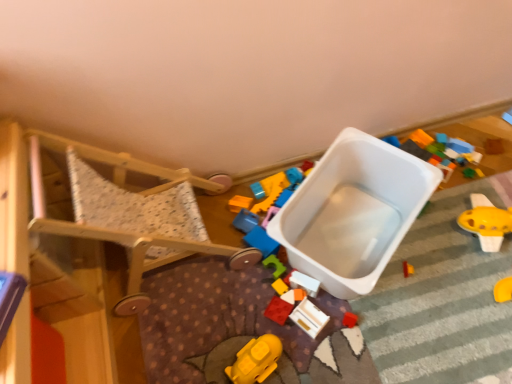
Find the location of a particular element. The image size is (512, 384). free area in between white plastic toy at center, the 3th toy positioned from the right, and yellow plastic toy at right, which is counted as the first toy, starting from the right is located at coordinates coord(411,253).